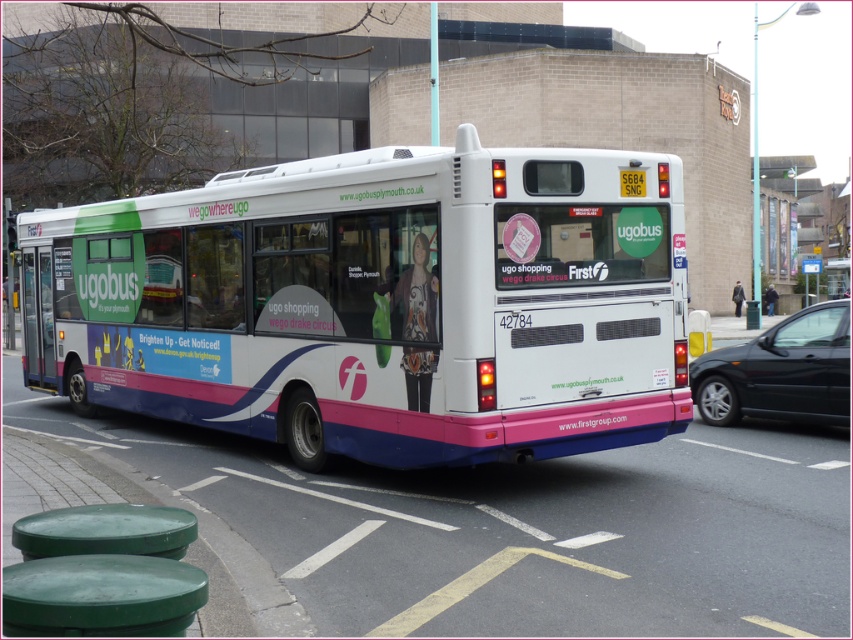
Does white matte bus at center have a lesser width compared to black glossy car at right?

No.

Which is behind, point (325, 332) or point (793, 392)?

Point (793, 392)

This screenshot has height=640, width=853. What are the coordinates of `white matte bus at center` in the screenshot? It's located at (376, 304).

Can you confirm if black glossy car at right is bigger than yellow plastic license plate at rear center?

Correct, black glossy car at right is larger in size than yellow plastic license plate at rear center.

Does black glossy car at right have a lesser height compared to yellow plastic license plate at rear center?

In fact, black glossy car at right may be taller than yellow plastic license plate at rear center.

The width and height of the screenshot is (853, 640). Identify the location of black glossy car at right. (780, 371).

In order to click on black glossy car at right in this screenshot , I will do `click(780, 371)`.

Does white matte bus at center appear on the right side of yellow plastic license plate at rear center?

In fact, white matte bus at center is to the left of yellow plastic license plate at rear center.

Between point (251, 433) and point (643, 180), which one is positioned behind?

The point (251, 433) is more distant.

Find the location of a particular element. This screenshot has width=853, height=640. white matte bus at center is located at coordinates (376, 304).

Where is `white matte bus at center`? white matte bus at center is located at coordinates (376, 304).